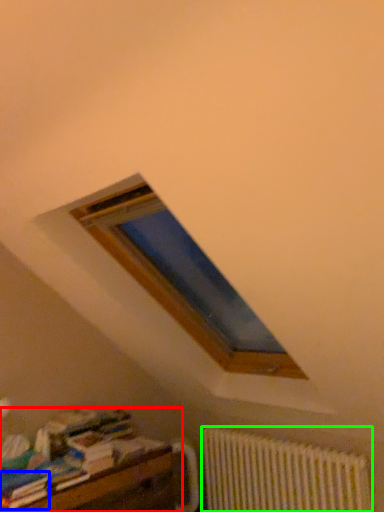
Question: Based on their relative distances, which object is nearer to furniture (highlighted by a red box)? Choose from paperback book (highlighted by a blue box) and radiator (highlighted by a green box).

Choices:
 (A) paperback book
 (B) radiator

Answer: (A)